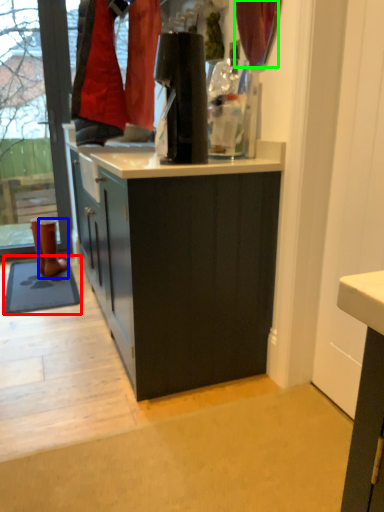
Question: Based on their relative distances, which object is nearer to mat (highlighted by a red box)? Choose from footwear (highlighted by a blue box) and curtain (highlighted by a green box).

Choices:
 (A) footwear
 (B) curtain

Answer: (A)